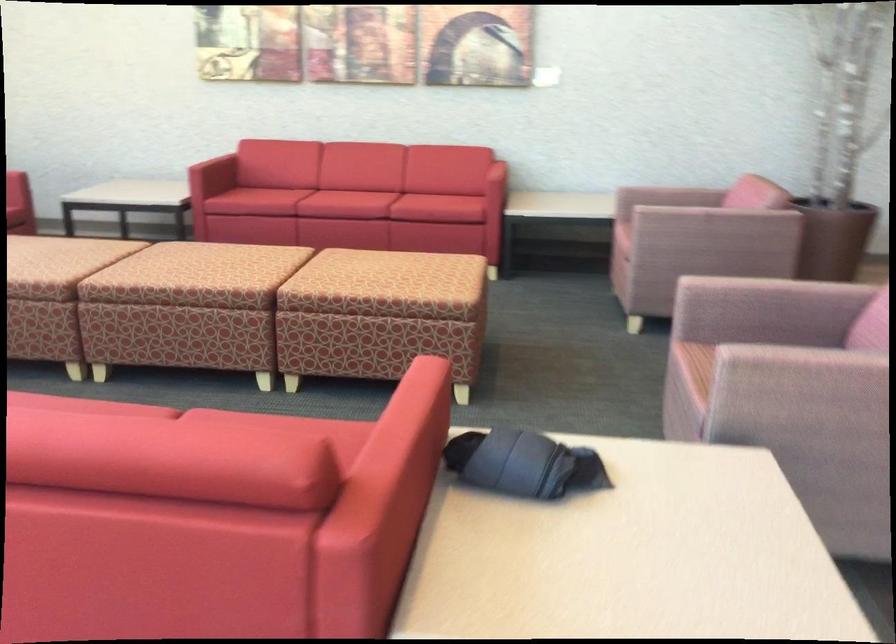
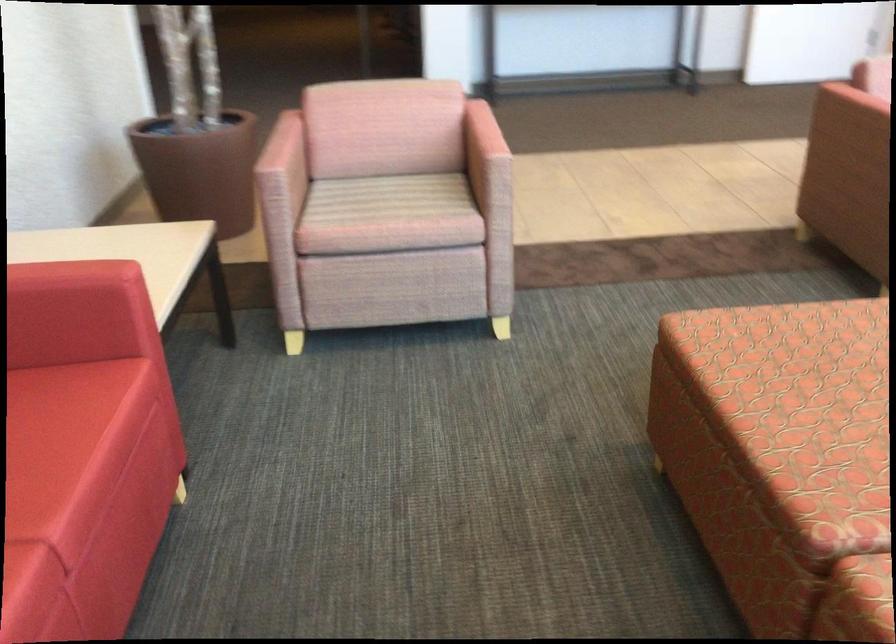
In the second image, find the point that corresponds to (x=454, y=183) in the first image.

(38, 408)